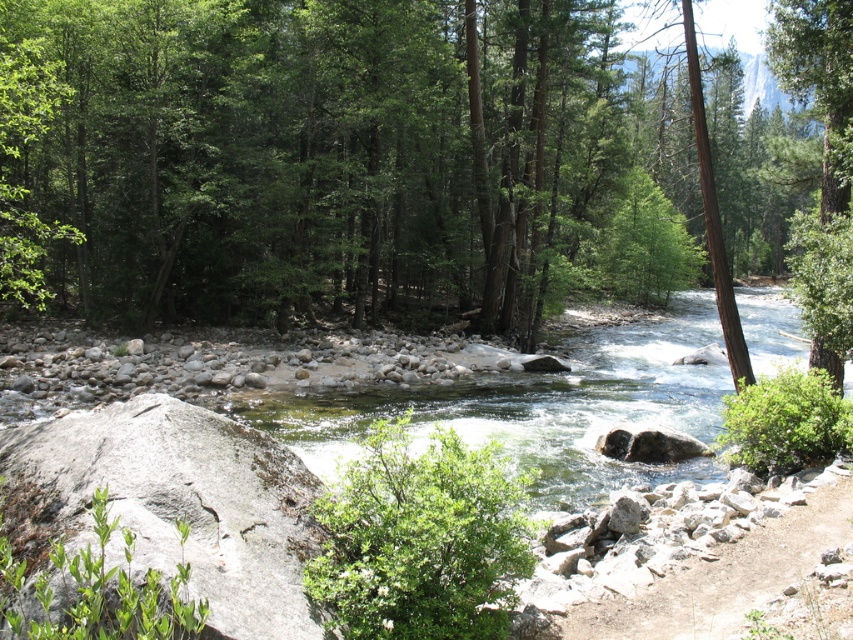
You are standing at the edge of the river and notice a green leafy tree at center and a brown rough tree trunk at right. Which tree is closer to your left side?

The brown rough tree trunk at right is closer to your left side because the green leafy tree at center is positioned to the right of it.

In the image of the forested river scene, there is a point labeled as point (373, 157). What object in the scene corresponds to this point?

The point (373, 157) corresponds to the green leafy tree at center.